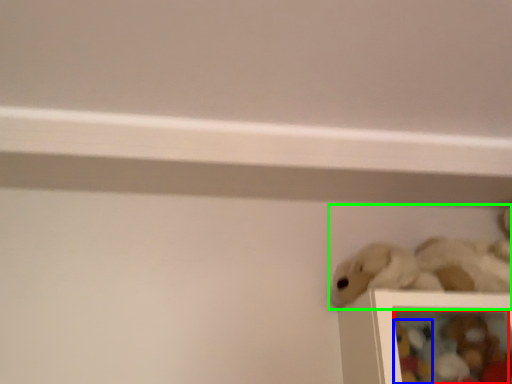
Question: Considering the real-world distances, which object is closest to toy (highlighted by a red box)? toy (highlighted by a blue box) or toy (highlighted by a green box).

Choices:
 (A) toy
 (B) toy

Answer: (A)